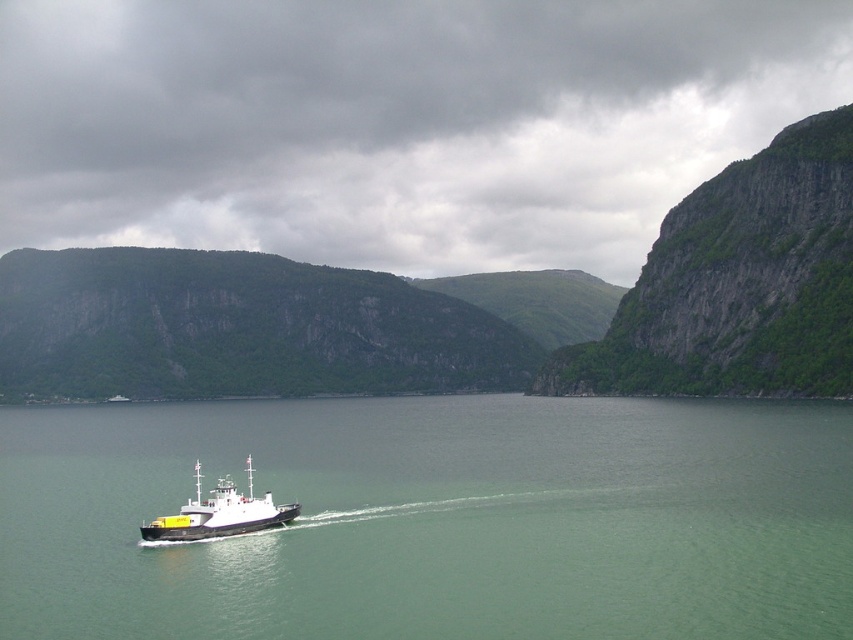
Question: Which point appears farthest from the camera in this image?

Choices:
 (A) (432, 524)
 (B) (540, 387)
 (C) (207, 500)

Answer: (B)

Question: Does green rocky cliff at center have a lesser width compared to black matte boat at center?

Choices:
 (A) no
 (B) yes

Answer: (A)

Question: Considering the real-world distances, which object is farthest from the green rocky cliff at upper right?

Choices:
 (A) black matte boat at center
 (B) green rocky cliff at center

Answer: (A)

Question: Does green water at center appear on the right side of black matte boat at center?

Choices:
 (A) no
 (B) yes

Answer: (B)

Question: Which object appears farthest from the camera in this image?

Choices:
 (A) black matte boat at center
 (B) green water at center

Answer: (A)

Question: From the image, what is the correct spatial relationship of green water at center in relation to green rocky cliff at upper right?

Choices:
 (A) below
 (B) above

Answer: (A)